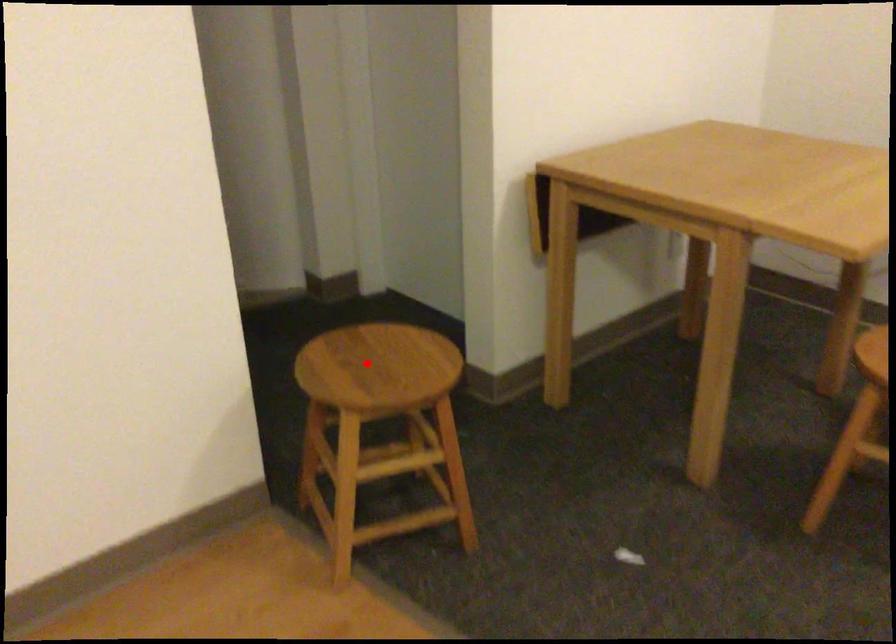
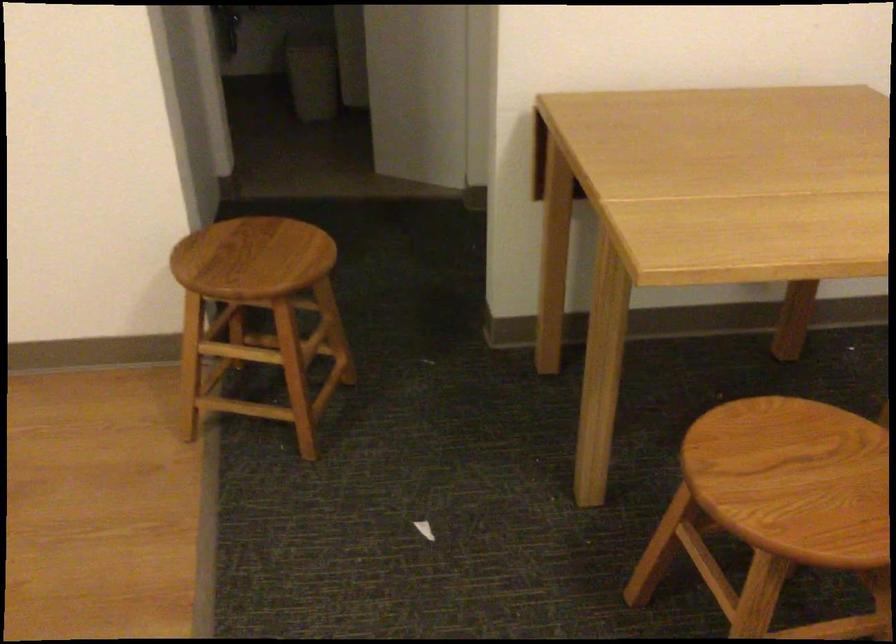
Question: I am providing you with two images of the same scene from different viewpoints. A red point is marked on the first image. At the location where the point appears in image 1, is it still visible in image 2?

Choices:
 (A) Yes
 (B) No

Answer: (A)